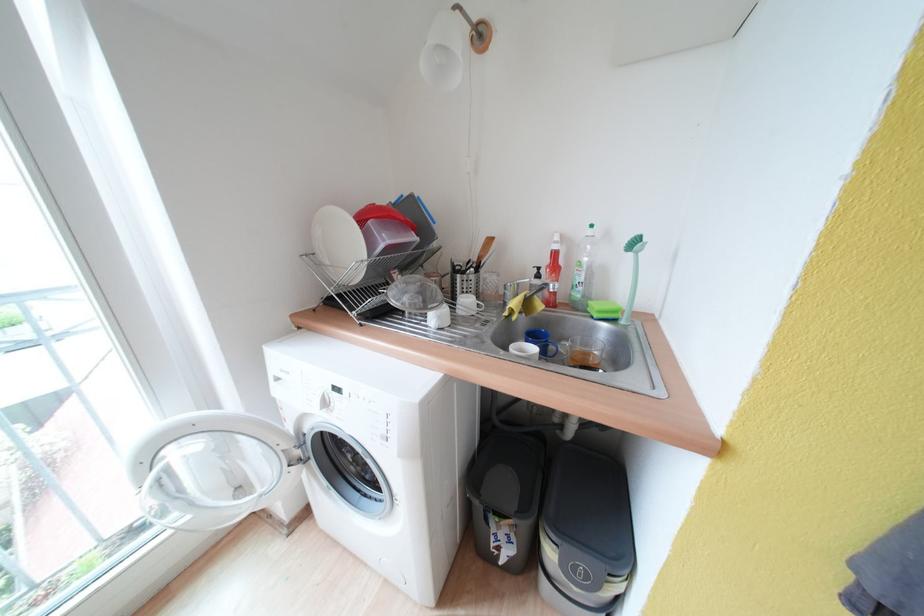
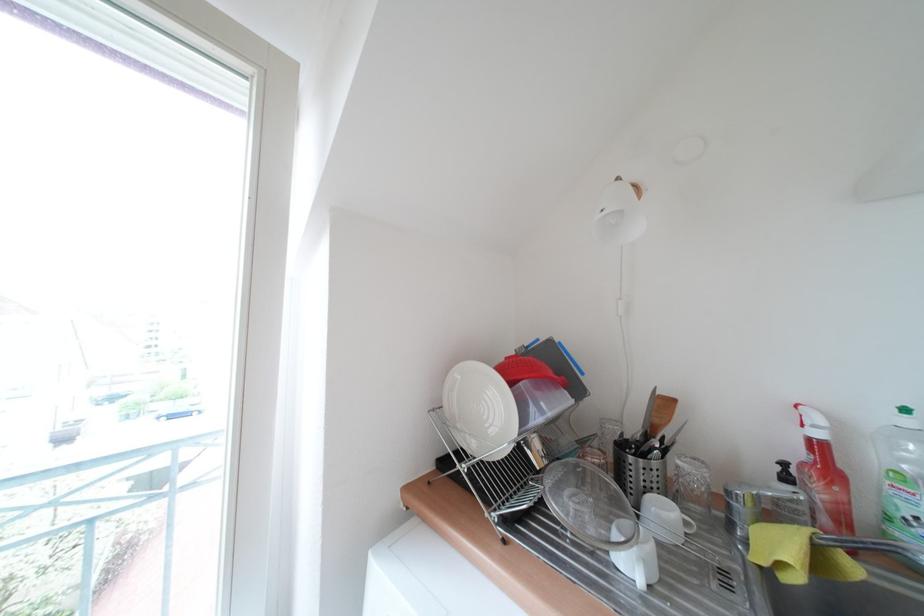
Locate, in the second image, the point that corresponds to point (543, 280) in the first image.

(793, 482)